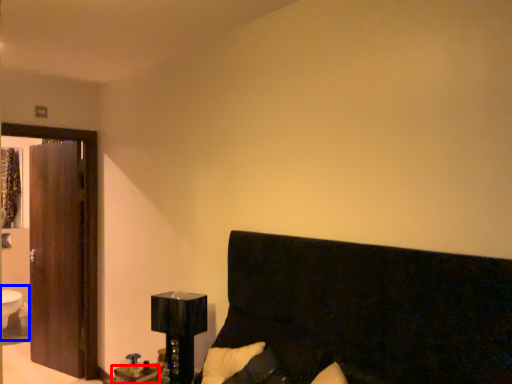
Question: Which of the following is the closest to the observer, table (highlighted by a red box) or sink (highlighted by a blue box)?

Choices:
 (A) table
 (B) sink

Answer: (A)